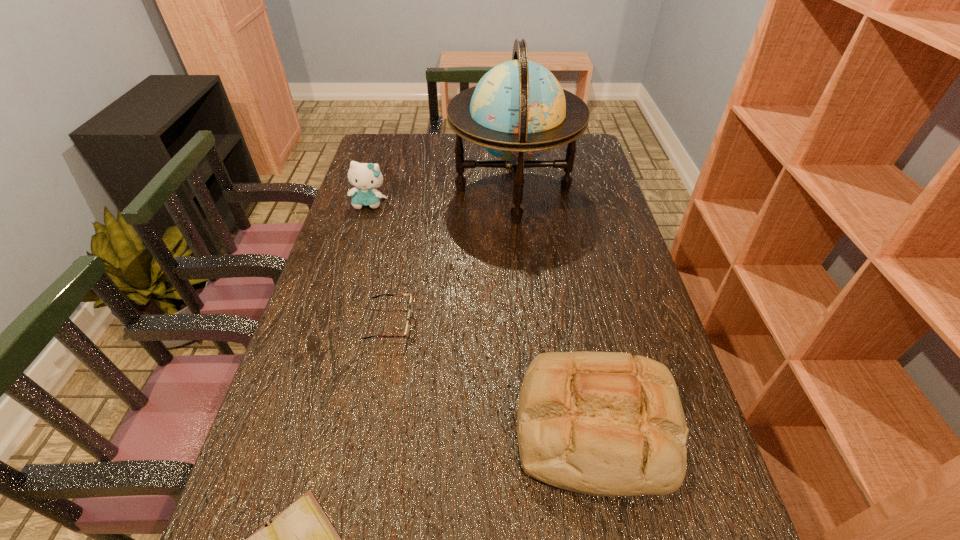
Identify the location of free space that satisfies the following two spatial constraints: 1. on the face of the kitten; 2. on the left side of the bread. (302, 427).

The height and width of the screenshot is (540, 960). In order to click on free space in the image that satisfies the following two spatial constraints: 1. on the frame of the bread; 2. on the left side of the third farthest object in this screenshot , I will do `click(372, 427)`.